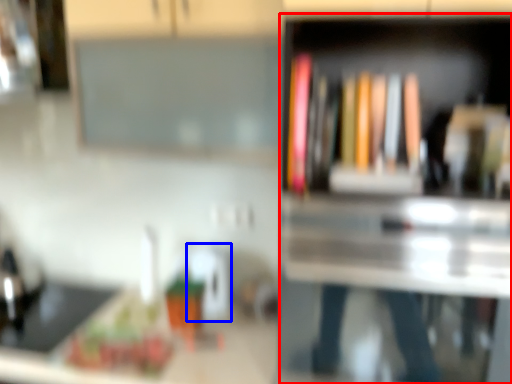
Question: Which object is further to the camera taking this photo, bookshelf (highlighted by a red box) or appliance (highlighted by a blue box)?

Choices:
 (A) bookshelf
 (B) appliance

Answer: (B)